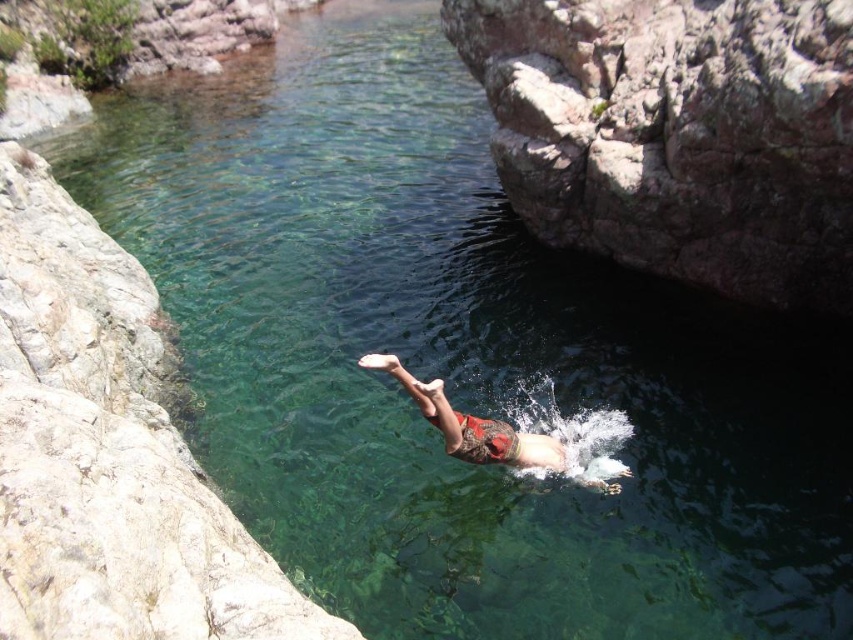
Is point (88, 232) behind point (486, 442)?

Yes, point (88, 232) is behind point (486, 442).

Does point (97, 580) come behind point (595, 483)?

No, it is not.

The width and height of the screenshot is (853, 640). Find the location of `smooth gray rock at left`. smooth gray rock at left is located at coordinates (107, 452).

Can you confirm if rusty rock at upper right is bigger than reddish-brown fabric diver at center?

No.

Between rusty rock at upper right and reddish-brown fabric diver at center, which one has less height?

rusty rock at upper right

Find the location of a particular element. The image size is (853, 640). rusty rock at upper right is located at coordinates (677, 134).

Identify the location of rusty rock at upper right. The width and height of the screenshot is (853, 640). (677, 134).

Between rusty rock at upper right and smooth gray rock at left, which one is positioned higher?

rusty rock at upper right

Identify the location of rusty rock at upper right. Image resolution: width=853 pixels, height=640 pixels. (677, 134).

Image resolution: width=853 pixels, height=640 pixels. Find the location of `rusty rock at upper right`. rusty rock at upper right is located at coordinates (677, 134).